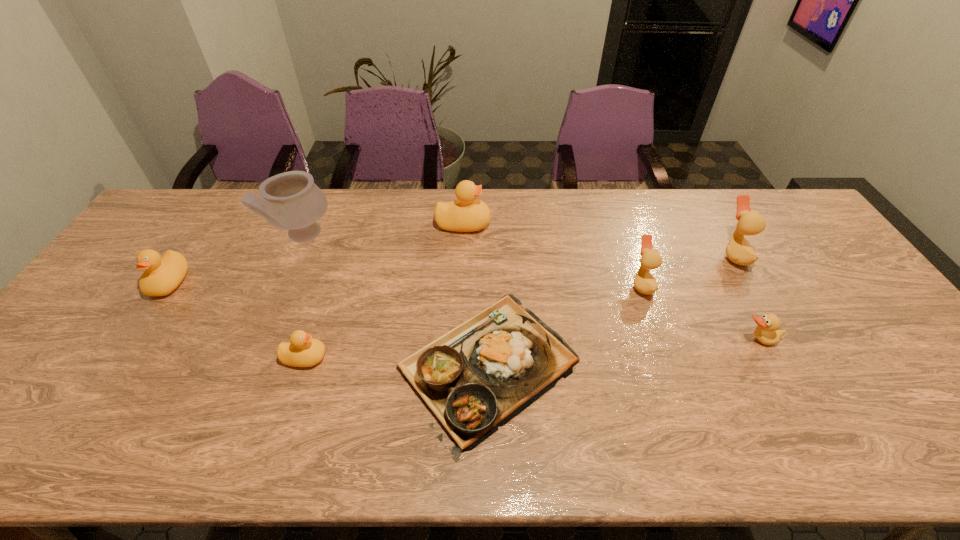
At what (x,y) coordinates should I click in order to perform the action: click on free space that satisfies the following two spatial constraints: 1. on the face of the platter; 2. on the left side of the leftmost duck. Please return your answer as a coordinate pair (x, y). The height and width of the screenshot is (540, 960). Looking at the image, I should click on (113, 366).